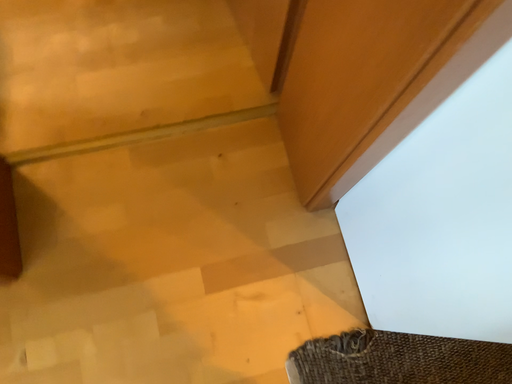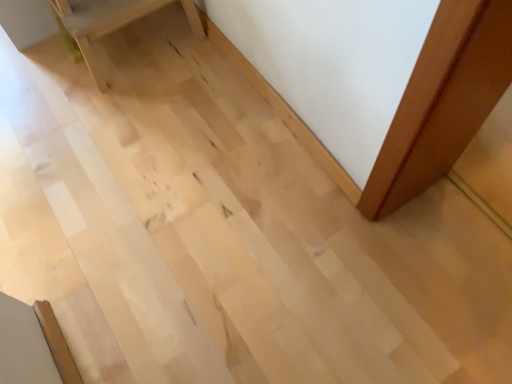
Question: How did the camera likely rotate when shooting the video?

Choices:
 (A) rotated left
 (B) rotated right

Answer: (A)